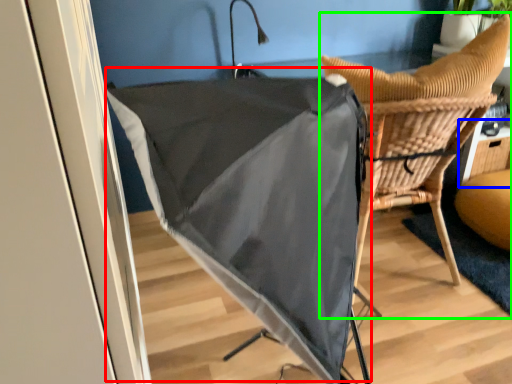
Question: Which is farther away from umbrella (highlighted by a red box)? table (highlighted by a blue box) or chair (highlighted by a green box)?

Choices:
 (A) table
 (B) chair

Answer: (A)